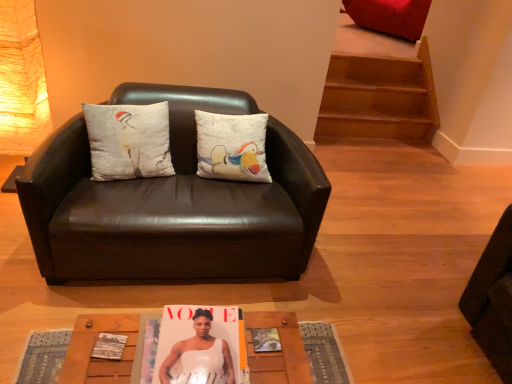
Question: Is the position of black leather couch at center more distant than that of white cotton cushion at center?

Choices:
 (A) no
 (B) yes

Answer: (A)

Question: Is black leather couch at center facing towards white cotton cushion at center?

Choices:
 (A) yes
 (B) no

Answer: (A)

Question: Can you confirm if black leather couch at center is wider than white cotton cushion at center?

Choices:
 (A) no
 (B) yes

Answer: (B)

Question: Is black leather couch at center positioned with its back to white cotton cushion at center?

Choices:
 (A) no
 (B) yes

Answer: (B)

Question: Is black leather couch at center at the left side of white cotton cushion at center?

Choices:
 (A) no
 (B) yes

Answer: (A)

Question: From a real-world perspective, does black leather couch at center sit lower than white cotton cushion at center?

Choices:
 (A) no
 (B) yes

Answer: (B)

Question: From the image's perspective, would you say wooden textured table at lower center is shown under white glossy magazine at center?

Choices:
 (A) yes
 (B) no

Answer: (A)

Question: Is wooden textured table at lower center bigger than white glossy magazine at center?

Choices:
 (A) yes
 (B) no

Answer: (B)

Question: Can you confirm if wooden textured table at lower center is smaller than white glossy magazine at center?

Choices:
 (A) yes
 (B) no

Answer: (A)

Question: Considering the relative sizes of wooden textured table at lower center and white glossy magazine at center in the image provided, is wooden textured table at lower center thinner than white glossy magazine at center?

Choices:
 (A) no
 (B) yes

Answer: (A)

Question: Are wooden textured table at lower center and white glossy magazine at center located far from each other?

Choices:
 (A) no
 (B) yes

Answer: (A)

Question: Considering the relative sizes of wooden textured table at lower center and white glossy magazine at center in the image provided, is wooden textured table at lower center taller than white glossy magazine at center?

Choices:
 (A) yes
 (B) no

Answer: (B)

Question: Is matte paper magazine at center wider than white cotton cushion at center?

Choices:
 (A) no
 (B) yes

Answer: (A)